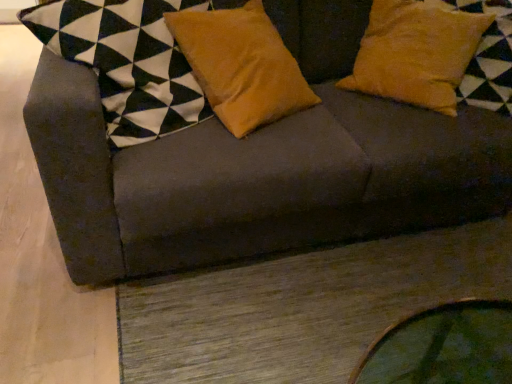
At what (x,y) coordinates should I click in order to perform the action: click on suede yellow pillow at upper right, which is the 2th pillow in left-to-right order. Please return your answer as a coordinate pair (x, y). The image size is (512, 384). Looking at the image, I should click on (416, 52).

Locate an element on the screen. The width and height of the screenshot is (512, 384). suede yellow pillow at upper right, the first pillow viewed from the right is located at coordinates (416, 52).

Is dark gray fabric couch at upper center not inside suede yellow pillow at upper right, which is the 2th pillow in left-to-right order?

That's correct, dark gray fabric couch at upper center is outside of suede yellow pillow at upper right, which is the 2th pillow in left-to-right order.

From the image's perspective, which one is positioned higher, dark gray fabric couch at upper center or suede yellow pillow at upper right, the first pillow viewed from the right?

suede yellow pillow at upper right, the first pillow viewed from the right, appears higher in the image.

From a real-world perspective, is dark gray fabric couch at upper center above or below suede yellow pillow at upper right, which is the 2th pillow in left-to-right order?

dark gray fabric couch at upper center is situated lower than suede yellow pillow at upper right, which is the 2th pillow in left-to-right order, in the real world.

Does point (357, 27) come in front of point (458, 68)?

No, it is not.

Is dark gray fabric couch at upper center next to velvet orange pillow at center, which is the 2th pillow in right-to-left order?

No, dark gray fabric couch at upper center is not beside velvet orange pillow at center, which is the 2th pillow in right-to-left order.

Which is more to the right, dark gray fabric couch at upper center or velvet orange pillow at center, which appears as the first pillow when viewed from the left?

Positioned to the right is dark gray fabric couch at upper center.

From a real-world perspective, which is physically below, dark gray fabric couch at upper center or velvet orange pillow at center, which is the 2th pillow in right-to-left order?

From a 3D spatial view, dark gray fabric couch at upper center is below.

How different are the orientations of dark gray fabric couch at upper center and velvet orange pillow at center, which is the 2th pillow in right-to-left order, in degrees?

The facing directions of dark gray fabric couch at upper center and velvet orange pillow at center, which is the 2th pillow in right-to-left order, are 15.5 degrees apart.

Considering the sizes of objects suede yellow pillow at upper right, the first pillow viewed from the right, and velvet orange pillow at center, which is the 2th pillow in right-to-left order, in the image provided, who is bigger, suede yellow pillow at upper right, the first pillow viewed from the right, or velvet orange pillow at center, which is the 2th pillow in right-to-left order,?

suede yellow pillow at upper right, the first pillow viewed from the right.

Which object is further away from the camera taking this photo, suede yellow pillow at upper right, the first pillow viewed from the right, or velvet orange pillow at center, which appears as the first pillow when viewed from the left?

suede yellow pillow at upper right, the first pillow viewed from the right.

From the image's perspective, would you say suede yellow pillow at upper right, which is the 2th pillow in left-to-right order, is shown under velvet orange pillow at center, which is the 2th pillow in right-to-left order?

No, from the image's perspective, suede yellow pillow at upper right, which is the 2th pillow in left-to-right order, is not below velvet orange pillow at center, which is the 2th pillow in right-to-left order.

Is suede yellow pillow at upper right, the first pillow viewed from the right, facing towards velvet orange pillow at center, which appears as the first pillow when viewed from the left?

No, suede yellow pillow at upper right, the first pillow viewed from the right, is not oriented towards velvet orange pillow at center, which appears as the first pillow when viewed from the left.

Which of these two, suede yellow pillow at upper right, the first pillow viewed from the right, or dark gray fabric couch at upper center, is smaller?

With smaller size is suede yellow pillow at upper right, the first pillow viewed from the right.

Considering the relative sizes of suede yellow pillow at upper right, which is the 2th pillow in left-to-right order, and dark gray fabric couch at upper center in the image provided, is suede yellow pillow at upper right, which is the 2th pillow in left-to-right order, thinner than dark gray fabric couch at upper center?

Yes.

From the picture: From a real-world perspective, which object stands above the other?

suede yellow pillow at upper right, the first pillow viewed from the right.

The height and width of the screenshot is (384, 512). What are the coordinates of `the 2nd pillow behind the dark gray fabric couch at upper center` in the screenshot? It's located at pos(416,52).

Consider the image. Are velvet orange pillow at center, which is the 2th pillow in right-to-left order, and dark gray fabric couch at upper center making contact?

No, velvet orange pillow at center, which is the 2th pillow in right-to-left order, is not touching dark gray fabric couch at upper center.

From a real-world perspective, who is located lower, velvet orange pillow at center, which is the 2th pillow in right-to-left order, or dark gray fabric couch at upper center?

dark gray fabric couch at upper center, from a real-world perspective.

There is a dark gray fabric couch at upper center. Identify the location of the 1st pillow above it (from the image's perspective). The image size is (512, 384). (241, 65).

Is velvet orange pillow at center, which is the 2th pillow in right-to-left order, taller than suede yellow pillow at upper right, which is the 2th pillow in left-to-right order?

Indeed, velvet orange pillow at center, which is the 2th pillow in right-to-left order, has a greater height compared to suede yellow pillow at upper right, which is the 2th pillow in left-to-right order.

In the scene shown: From a real-world perspective, is velvet orange pillow at center, which appears as the first pillow when viewed from the left, physically located above or below suede yellow pillow at upper right, the first pillow viewed from the right?

From a real-world perspective, velvet orange pillow at center, which appears as the first pillow when viewed from the left, is physically below suede yellow pillow at upper right, the first pillow viewed from the right.

From the image's perspective, is velvet orange pillow at center, which appears as the first pillow when viewed from the left, located above suede yellow pillow at upper right, which is the 2th pillow in left-to-right order?

No.

Which of these two, velvet orange pillow at center, which is the 2th pillow in right-to-left order, or suede yellow pillow at upper right, the first pillow viewed from the right, is thinner?

Thinner between the two is velvet orange pillow at center, which is the 2th pillow in right-to-left order.

Locate an element on the screen. studio couch on the left of suede yellow pillow at upper right, the first pillow viewed from the right is located at coordinates (260, 165).

Identify the location of pillow that is the 1st one above the dark gray fabric couch at upper center (from a real-world perspective). (241, 65).

In the scene shown: When comparing their distances from suede yellow pillow at upper right, which is the 2th pillow in left-to-right order, does dark gray fabric couch at upper center or velvet orange pillow at center, which is the 2th pillow in right-to-left order, seem closer?

dark gray fabric couch at upper center is positioned closer to the anchor suede yellow pillow at upper right, which is the 2th pillow in left-to-right order.

Based on their spatial positions, is dark gray fabric couch at upper center or suede yellow pillow at upper right, the first pillow viewed from the right, further from velvet orange pillow at center, which is the 2th pillow in right-to-left order?

Among the two, suede yellow pillow at upper right, the first pillow viewed from the right, is located further to velvet orange pillow at center, which is the 2th pillow in right-to-left order.

When comparing their distances from velvet orange pillow at center, which is the 2th pillow in right-to-left order, does suede yellow pillow at upper right, which is the 2th pillow in left-to-right order, or dark gray fabric couch at upper center seem closer?

dark gray fabric couch at upper center is positioned closer to the anchor velvet orange pillow at center, which is the 2th pillow in right-to-left order.

Which object lies nearer to the anchor point suede yellow pillow at upper right, which is the 2th pillow in left-to-right order, velvet orange pillow at center, which is the 2th pillow in right-to-left order, or dark gray fabric couch at upper center?

The object closer to suede yellow pillow at upper right, which is the 2th pillow in left-to-right order, is dark gray fabric couch at upper center.

When comparing their distances from dark gray fabric couch at upper center, does suede yellow pillow at upper right, the first pillow viewed from the right, or velvet orange pillow at center, which appears as the first pillow when viewed from the left, seem closer?

velvet orange pillow at center, which appears as the first pillow when viewed from the left, lies closer to dark gray fabric couch at upper center than the other object.

Which object lies further to the anchor point dark gray fabric couch at upper center, velvet orange pillow at center, which is the 2th pillow in right-to-left order, or suede yellow pillow at upper right, the first pillow viewed from the right?

suede yellow pillow at upper right, the first pillow viewed from the right, lies further to dark gray fabric couch at upper center than the other object.

Identify the location of studio couch between velvet orange pillow at center, which appears as the first pillow when viewed from the left, and suede yellow pillow at upper right, the first pillow viewed from the right, from left to right. (260, 165).